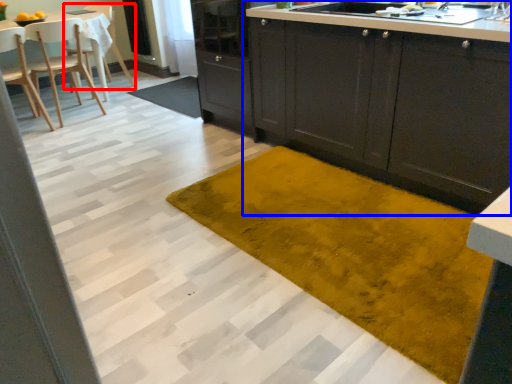
Question: Which of the following is the farthest to the observer, chair (highlighted by a red box) or cabinetry (highlighted by a blue box)?

Choices:
 (A) chair
 (B) cabinetry

Answer: (A)